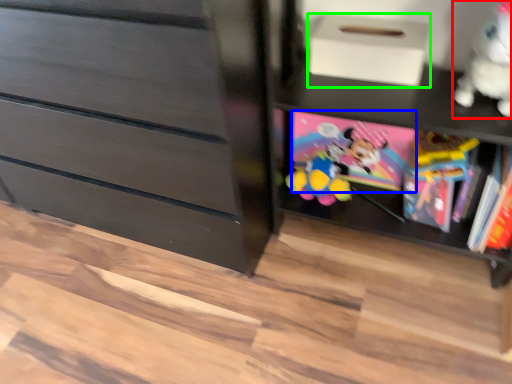
Question: Based on their relative distances, which object is nearer to toy (highlighted by a red box)? Choose from book (highlighted by a blue box) and shoe box (highlighted by a green box).

Choices:
 (A) book
 (B) shoe box

Answer: (B)